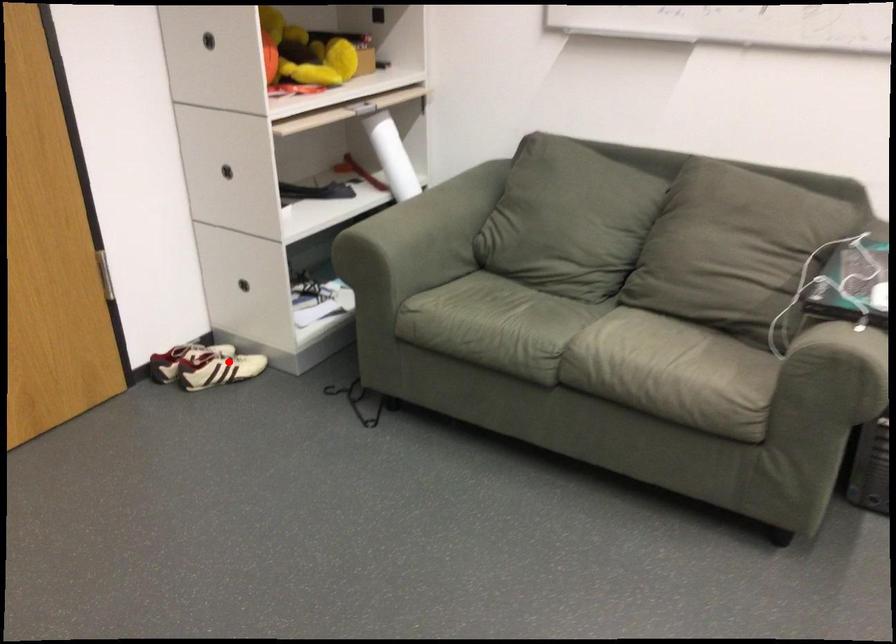
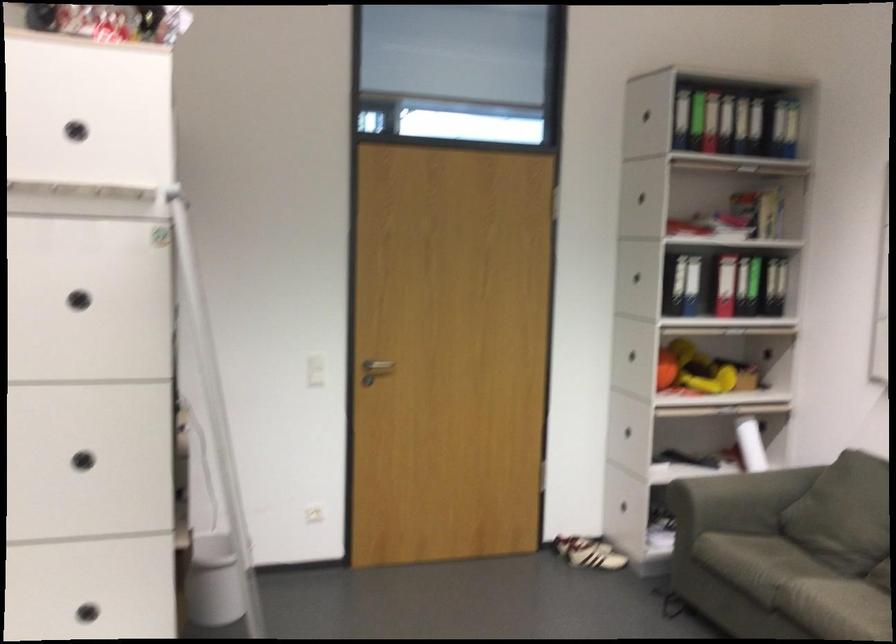
Locate, in the second image, the point that corresponds to the highlighted location in the first image.

(583, 552)